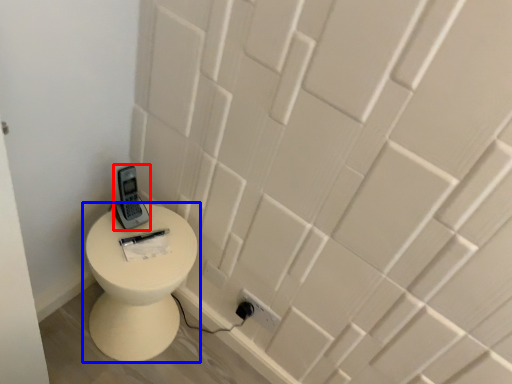
Question: Which point is closer to the camera, control (highlighted by a red box) or toilet (highlighted by a blue box)?

Choices:
 (A) control
 (B) toilet

Answer: (B)